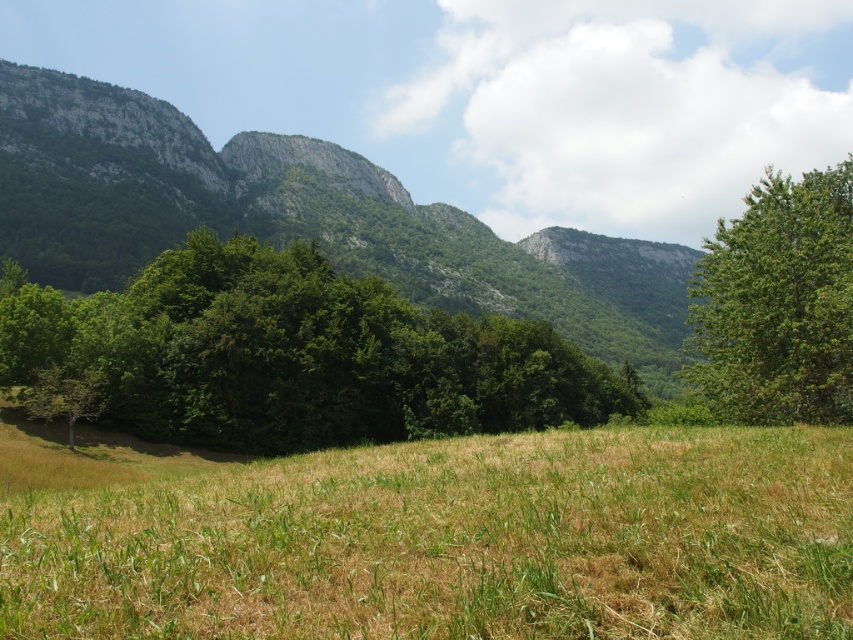
You are planning to take a photo of the green rock mountain at center and the green leafy tree at right. To ensure both are fully visible in the frame, which object should you focus on first considering their widths?

You should focus on the green rock mountain at center first because it might be wider than the green leafy tree at right, so ensuring it fits properly would be essential.

You are standing at the center of the field of grass. You want to walk towards the mountains in the background. Is the brown dry grass at lower center in your path?

The brown dry grass at lower center is located at point [456,541]. Since you are starting at the center of the field and moving towards the mountains in the background, the brown dry grass at lower center would be in your path as it is positioned along the lower center area, which is directly ahead of you.